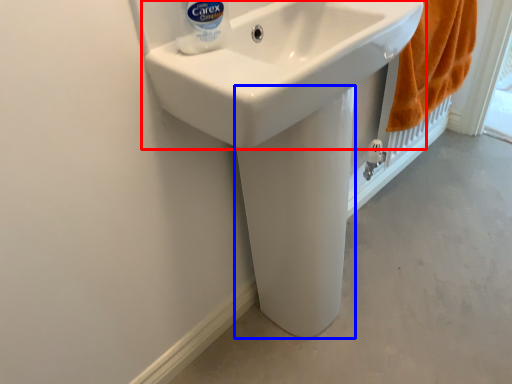
Question: Which object is further to the camera taking this photo, sink (highlighted by a red box) or bidet (highlighted by a blue box)?

Choices:
 (A) sink
 (B) bidet

Answer: (B)